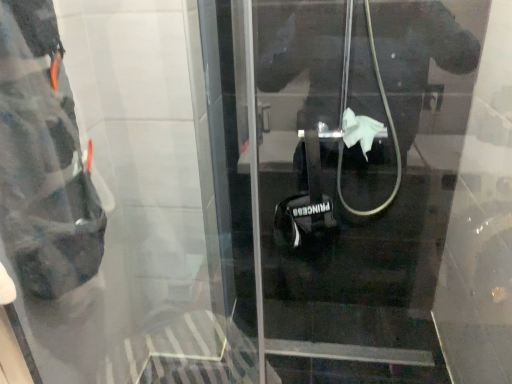
Question: From a real-world perspective, relative to transparent plastic door at center, is black matte bag at left vertically above or below?

Choices:
 (A) below
 (B) above

Answer: (B)

Question: Looking at the image, does black matte bag at left seem bigger or smaller compared to transparent plastic door at center?

Choices:
 (A) small
 (B) big

Answer: (A)

Question: Which is correct: black matte bag at left is inside transparent plastic door at center, or outside of it?

Choices:
 (A) outside
 (B) inside

Answer: (A)

Question: Is transparent plastic door at center in front of or behind black matte bag at left in the image?

Choices:
 (A) front
 (B) behind

Answer: (A)

Question: In the image, is transparent plastic door at center on the left side or the right side of black matte bag at left?

Choices:
 (A) left
 (B) right

Answer: (B)

Question: From a real-world perspective, is transparent plastic door at center positioned above or below black matte bag at left?

Choices:
 (A) below
 (B) above

Answer: (A)

Question: Looking at their shapes, would you say transparent plastic door at center is wider or thinner than black matte bag at left?

Choices:
 (A) wide
 (B) thin

Answer: (B)